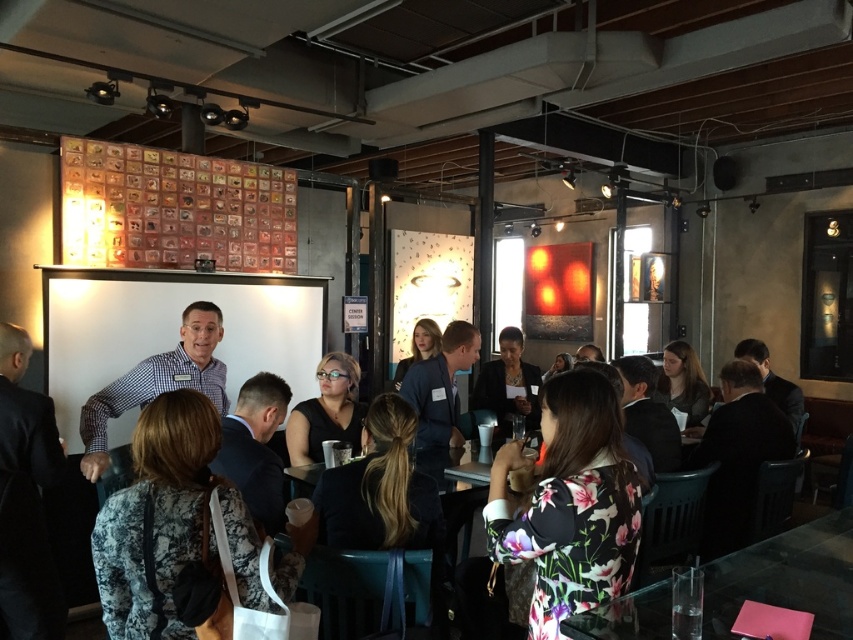
Between point (9, 522) and point (97, 419), which one is positioned behind?

The point (97, 419) is more distant.

Between point (33, 525) and point (158, 371), which one is positioned behind?

Point (158, 371)

Locate an element on the screen. black suit at left is located at coordinates (25, 499).

Who is more forward, (582,573) or (207,362)?

Positioned in front is point (582,573).

Is floral-patterned jacket at lower right above checkered shirt at center?

No.

Is point (589, 422) farther from camera compared to point (94, 465)?

No, (589, 422) is in front of (94, 465).

Find the location of a particular element. The image size is (853, 640). floral-patterned jacket at lower right is located at coordinates (570, 504).

Who is lower down, floral-patterned dress at center or floral-patterned jacket at lower right?

floral-patterned jacket at lower right is below.

Is floral-patterned dress at center below floral-patterned jacket at lower right?

No, floral-patterned dress at center is not below floral-patterned jacket at lower right.

The height and width of the screenshot is (640, 853). In order to click on floral-patterned dress at center in this screenshot , I will do `click(173, 531)`.